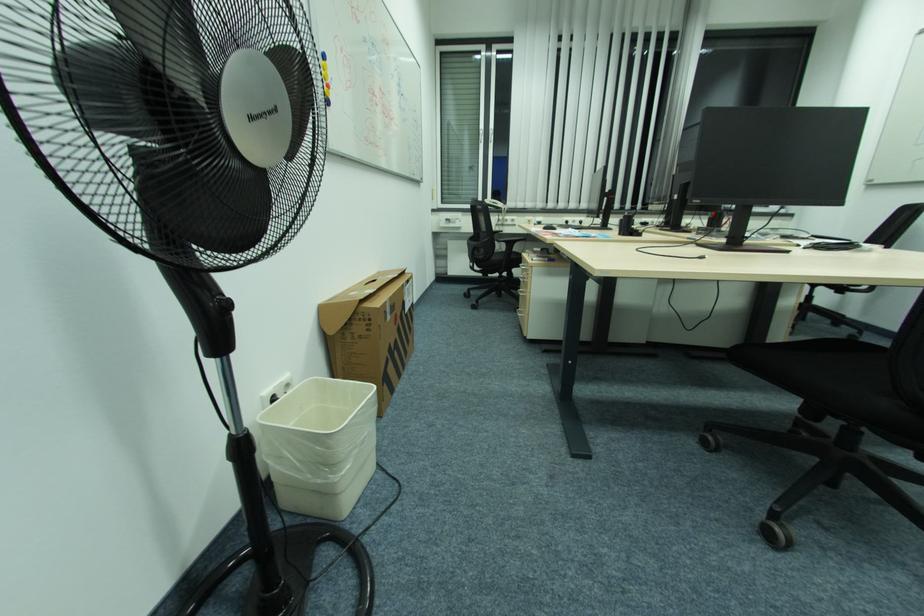
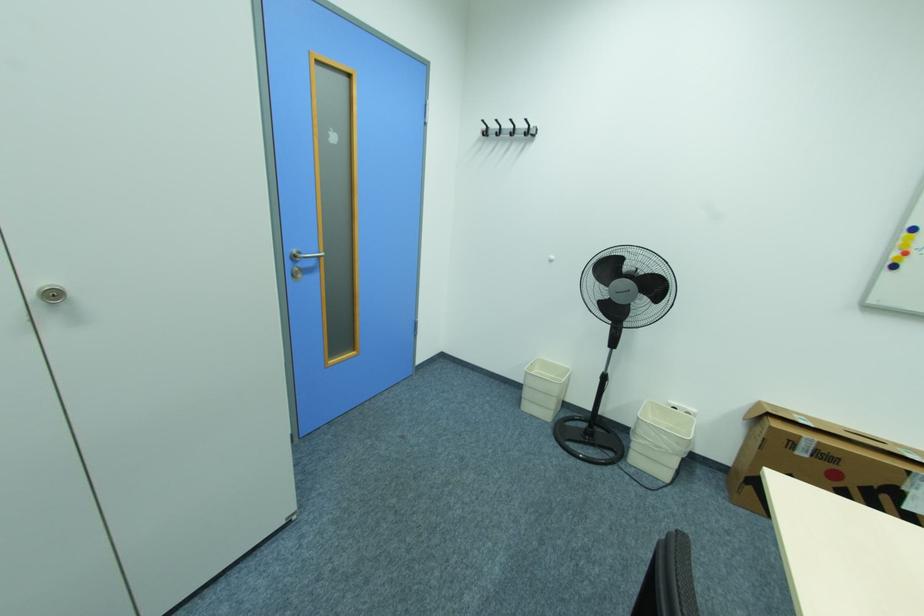
Locate, in the second image, the point that corresponds to point (391, 302) in the first image.

(805, 437)